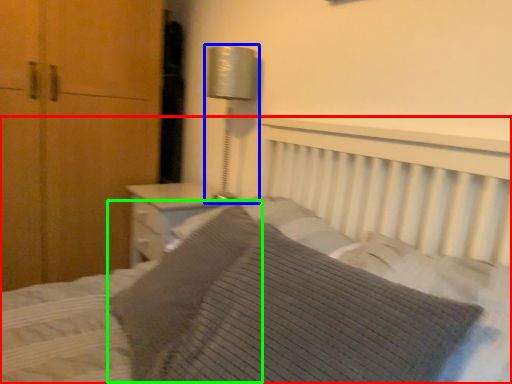
Question: Which is farther away from bed (highlighted by a red box)? bedside lamp (highlighted by a blue box) or pillow (highlighted by a green box)?

Choices:
 (A) bedside lamp
 (B) pillow

Answer: (A)